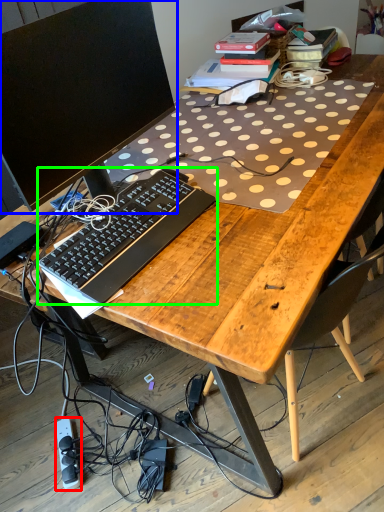
Question: Which object is the closest to the equipment (highlighted by a red box)? Choose among these: computer monitor (highlighted by a blue box) or computer keyboard (highlighted by a green box).

Choices:
 (A) computer monitor
 (B) computer keyboard

Answer: (B)